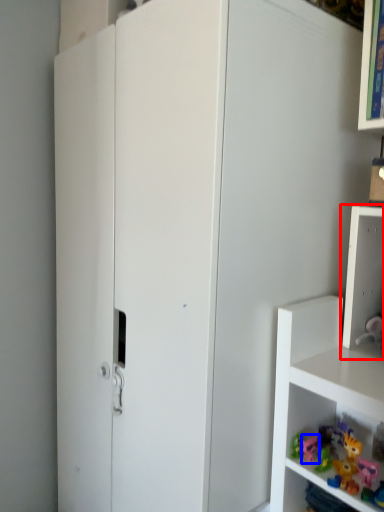
Question: Among these objects, which one is nearest to the camera, shelf (highlighted by a red box) or toy (highlighted by a blue box)?

Choices:
 (A) shelf
 (B) toy

Answer: (A)